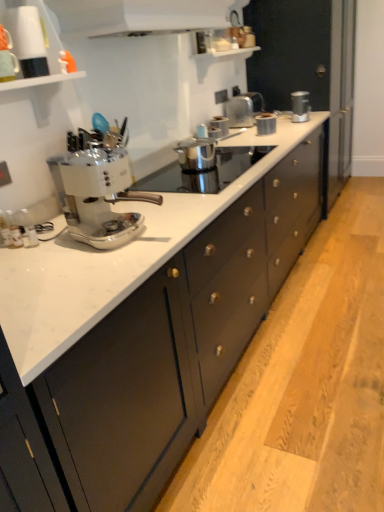
Question: Is white glossy range hood at upper center closer to camera compared to matte black cabinets at center?

Choices:
 (A) yes
 (B) no

Answer: (B)

Question: From the image's perspective, is white glossy range hood at upper center over matte black cabinets at center?

Choices:
 (A) no
 (B) yes

Answer: (B)

Question: Is matte black cabinets at center inside white glossy range hood at upper center?

Choices:
 (A) no
 (B) yes

Answer: (A)

Question: Would you say white glossy range hood at upper center is a long distance from matte black cabinets at center?

Choices:
 (A) yes
 (B) no

Answer: (A)

Question: Is white glossy range hood at upper center turned away from matte black cabinets at center?

Choices:
 (A) no
 (B) yes

Answer: (A)

Question: Is metallic silver toaster at center, marked as the second appliance in a front-to-back arrangement, to the left or to the right of metallic silver toaster at upper right, positioned as the second kitchen appliance in left-to-right order, in the image?

Choices:
 (A) left
 (B) right

Answer: (A)

Question: Is metallic silver toaster at center, which is counted as the first appliance, starting from the back, spatially inside metallic silver toaster at upper right, marked as the 2th kitchen appliance in a front-to-back arrangement, or outside of it?

Choices:
 (A) inside
 (B) outside

Answer: (B)

Question: Looking at the image, does metallic silver toaster at center, placed as the first appliance when sorted from top to bottom, seem bigger or smaller compared to metallic silver toaster at upper right, positioned as the 1th kitchen appliance in back-to-front order?

Choices:
 (A) small
 (B) big

Answer: (B)

Question: Does point (251, 124) appear closer or farther from the camera than point (297, 99)?

Choices:
 (A) closer
 (B) farther

Answer: (A)

Question: Is metallic silver toaster at upper center, acting as the 1th kitchen appliance starting from the bottom, wider or thinner than metallic silver toaster at upper right, positioned as the second kitchen appliance in left-to-right order?

Choices:
 (A) wide
 (B) thin

Answer: (A)

Question: In the image, is metallic silver toaster at upper center, which appears as the second kitchen appliance when viewed from the top, on the left side or the right side of metallic silver toaster at upper right, positioned as the 2th kitchen appliance in bottom-to-top order?

Choices:
 (A) right
 (B) left

Answer: (B)

Question: Does point (264, 134) appear closer or farther from the camera than point (296, 102)?

Choices:
 (A) closer
 (B) farther

Answer: (A)

Question: Is metallic silver toaster at upper center, acting as the 1th kitchen appliance starting from the bottom, inside or outside of metallic silver toaster at upper right, positioned as the 2th kitchen appliance in bottom-to-top order?

Choices:
 (A) outside
 (B) inside

Answer: (A)

Question: In the image, is metallic silver toaster at center, the second appliance in the right-to-left sequence, positioned in front of or behind white glossy range hood at upper center?

Choices:
 (A) front
 (B) behind

Answer: (B)

Question: From the image's perspective, is metallic silver toaster at center, the 1th appliance from the front, located above or below white glossy range hood at upper center?

Choices:
 (A) above
 (B) below

Answer: (B)